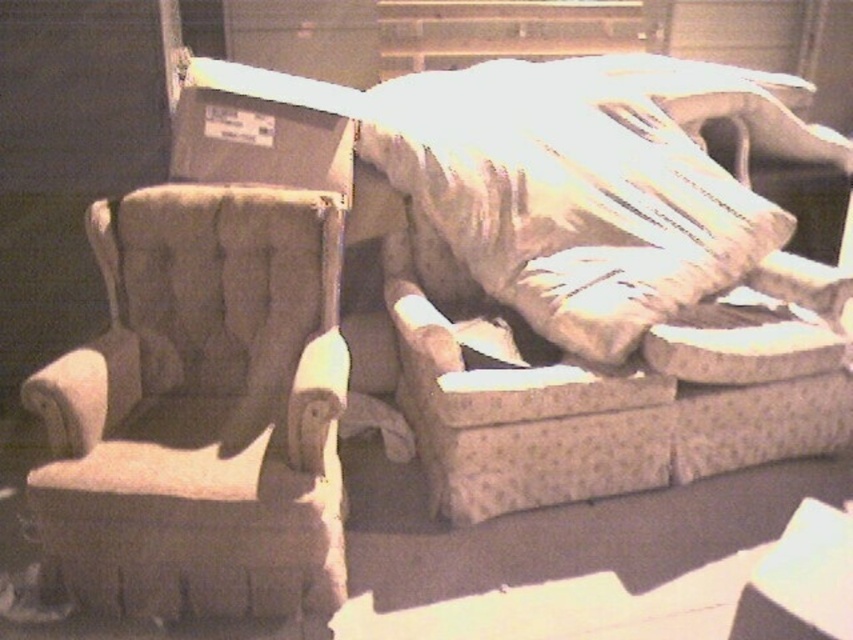
You are moving a large sofa into the room and need to navigate around the tufted fabric armchair at left and the matte gray cardboard box at upper left. The sofa is 22 inches wide. Can you maneuver the sofa between them without touching either?

The distance between the tufted fabric armchair at left and the matte gray cardboard box at upper left is 21.54 inches. Since the sofa is 22 inches wide, it is slightly wider than the available space. Therefore, you cannot maneuver the sofa between them without touching either.

You are moving a matte gray cardboard box at upper left into a new room. The tufted fabric armchair at left is already in the room. To place the box so it doesn

The tufted fabric armchair at left is to the left of matte gray cardboard box at upper left, so you should position the matte gray cardboard box at upper left to the right side of the tufted fabric armchair at left.